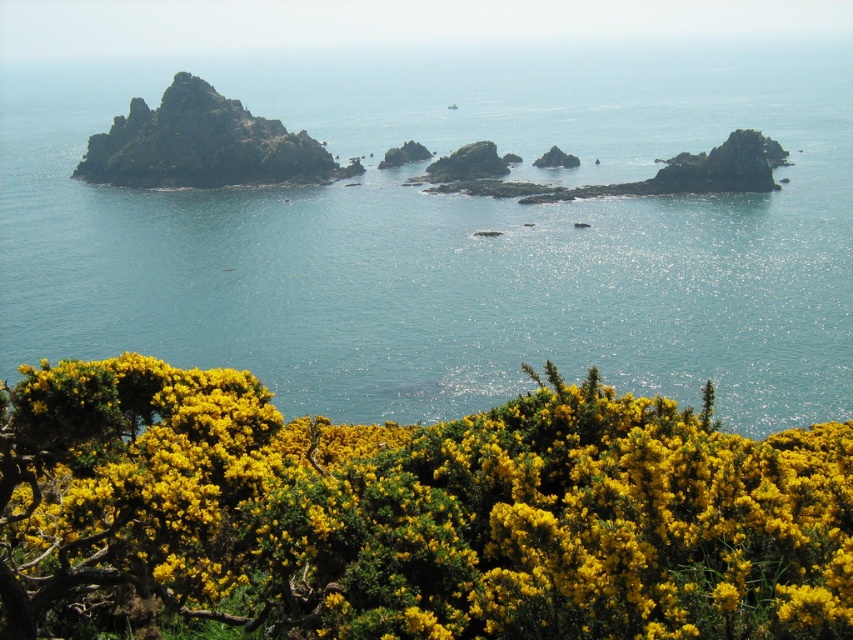
Can you confirm if clear blue water at center is shorter than rugged stone rock at left?

No.

Can you confirm if clear blue water at center is bigger than rugged stone rock at left?

Yes.

You are a GUI agent. You are given a task and a screenshot of the screen. Output one action in this format:
    pyautogui.click(x=<x>, y=<y>)
    Task: Click on the clear blue water at center
    Image resolution: width=853 pixels, height=640 pixels.
    Given the screenshot: What is the action you would take?
    pyautogui.click(x=451, y=234)

Who is more forward, (795, 433) or (213, 113)?

Point (795, 433) is more forward.

Between yellow textured bush at lower center and rugged stone rock at left, which one is positioned lower?

Positioned lower is yellow textured bush at lower center.

Is point (28, 577) closer to viewer compared to point (88, 172)?

Yes, point (28, 577) is closer to viewer.

Locate an element on the screen. Image resolution: width=853 pixels, height=640 pixels. yellow textured bush at lower center is located at coordinates (410, 515).

Is clear blue water at center shorter than yellow textured bush at lower center?

Incorrect, clear blue water at center's height does not fall short of yellow textured bush at lower center's.

Who is positioned more to the right, clear blue water at center or yellow textured bush at lower center?

Positioned to the right is clear blue water at center.

Who is more distant from viewer, (663, 225) or (321, 625)?

The point (663, 225) is more distant.

I want to click on clear blue water at center, so click(x=451, y=234).